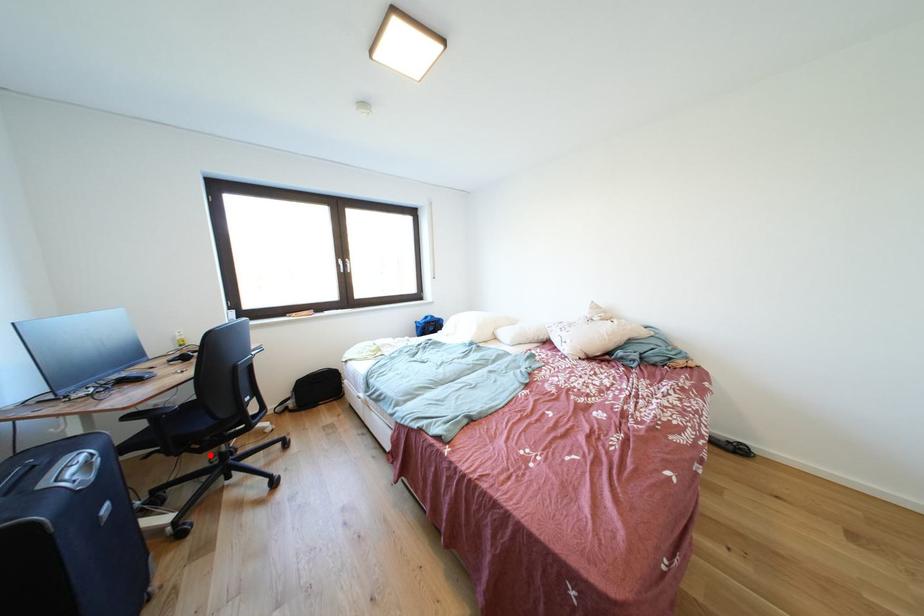
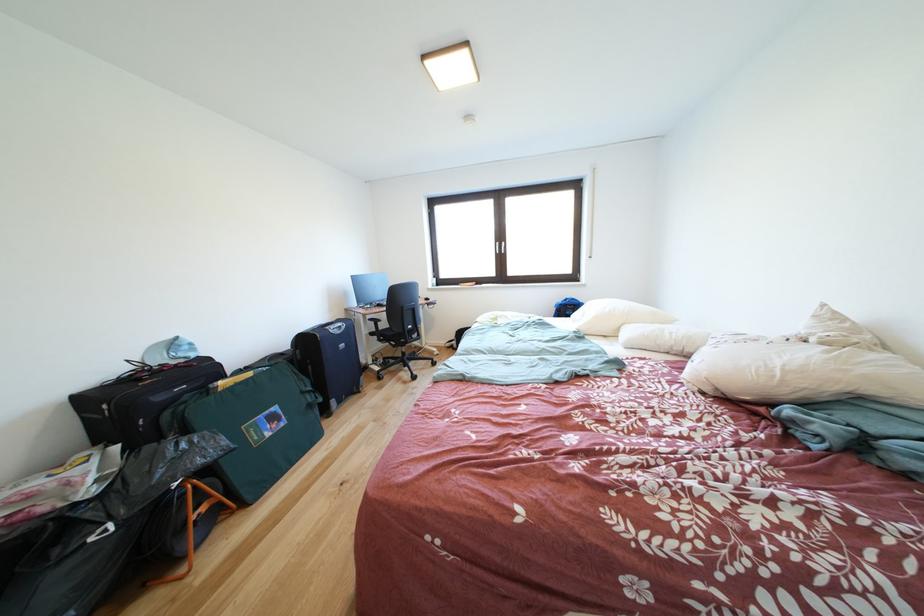
Question: I am providing you with two images of the same scene from different viewpoints. Given a red point in image1, look at the same physical point in image2. Is it:

Choices:
 (A) Closer to the viewpoint
 (B) Farther from the viewpoint

Answer: (B)